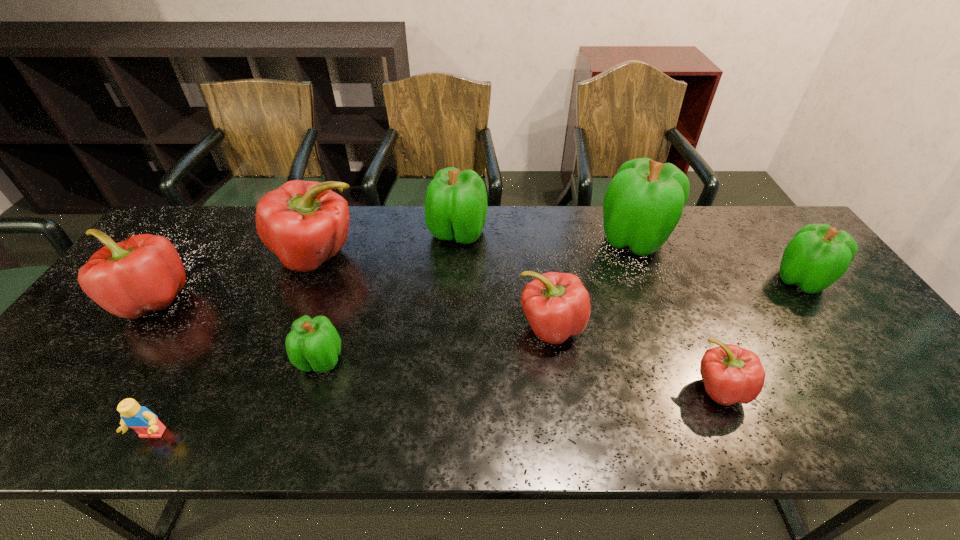
This screenshot has height=540, width=960. I want to click on vacant space located on the back of the rightmost bell pepper, so click(x=765, y=232).

Locate an element on the screen. The image size is (960, 540). free space located on the right of the third pink bell pepper from left to right is located at coordinates (702, 327).

Identify the location of free space located on the right of the leftmost green bell pepper. (476, 360).

Find the location of a particular element. This screenshot has width=960, height=540. vacant space situated 0.150m on the back of the nearest pink bell pepper is located at coordinates (688, 318).

This screenshot has width=960, height=540. I want to click on bell pepper present at the near edge, so click(731, 374).

Locate an element on the screen. Lego at the near edge is located at coordinates (139, 418).

The height and width of the screenshot is (540, 960). In order to click on object that is at the left edge in this screenshot , I will do `click(143, 273)`.

The image size is (960, 540). I want to click on object present at the right edge, so click(818, 255).

In the image, there is a desktop. At what (x,y) coordinates should I click in order to perform the action: click on free space at the far edge. Please return your answer as a coordinate pair (x, y). This screenshot has height=540, width=960. Looking at the image, I should click on (739, 228).

Identify the location of free location at the near edge of the desktop. (788, 432).